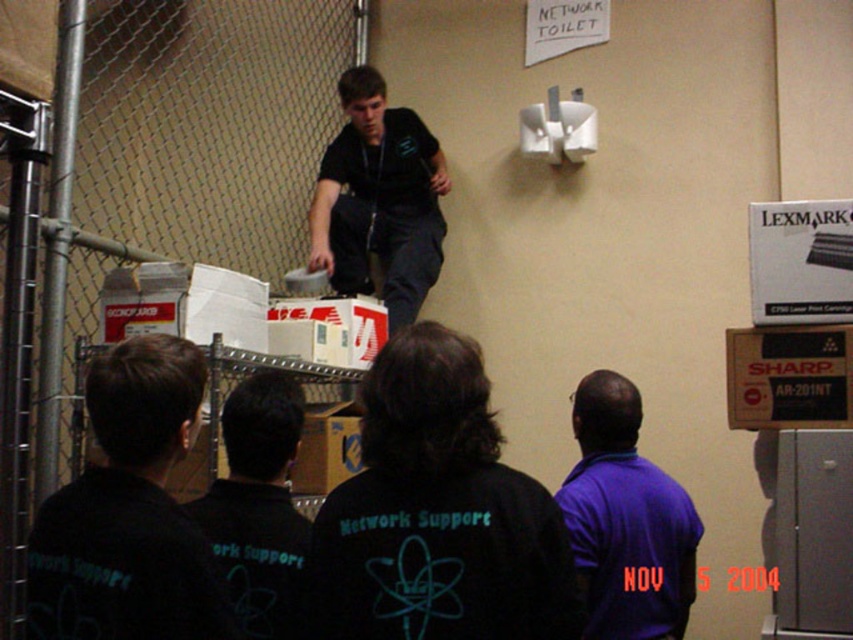
Question: Observing the image, what is the correct spatial positioning of dark blue shirt at upper center in reference to black fabric shirt at center?

Choices:
 (A) left
 (B) right

Answer: (B)

Question: Which object is positioned farthest from the black matte shirt at lower left?

Choices:
 (A) black fabric shirt at center
 (B) purple matte shirt at center

Answer: (B)

Question: Which point is farther from the camera taking this photo?

Choices:
 (A) (415, 280)
 (B) (252, 268)
 (C) (195, 390)

Answer: (B)

Question: Which object is positioned farthest from the black fabric shirt at center?

Choices:
 (A) metal chain-link fence at left
 (B) dark blue shirt at upper center

Answer: (A)

Question: From the image, what is the correct spatial relationship of metal chain-link fence at left in relation to black matte shirt at lower left?

Choices:
 (A) above
 (B) below

Answer: (A)

Question: Is black matte shirt at lower left to the right of purple matte shirt at center from the viewer's perspective?

Choices:
 (A) no
 (B) yes

Answer: (A)